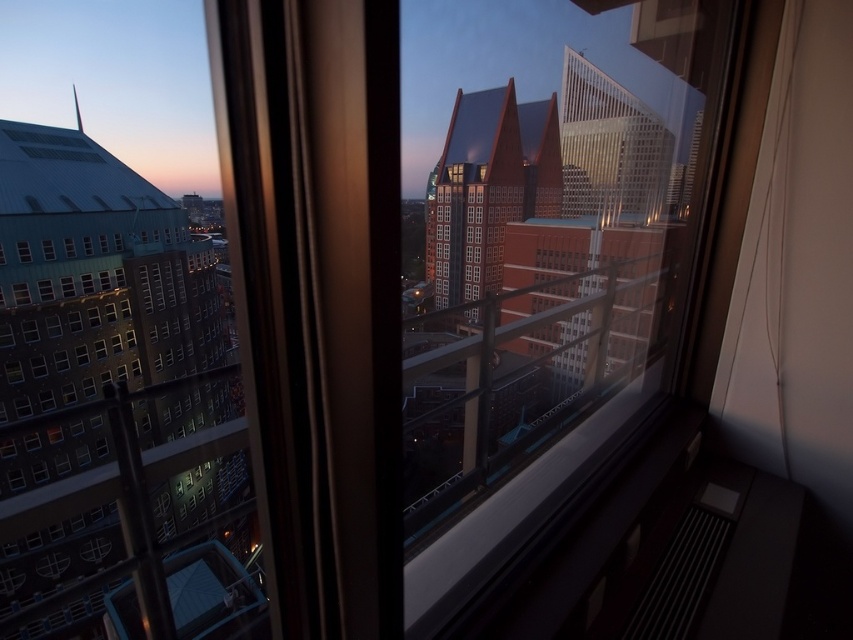
You are standing inside the building and want to look out through the transparent glass window at lower left. Where exactly should you position yourself to ensure you can see the entire view outside through it?

To see the entire view outside through the transparent glass window at lower left, you should position yourself directly in front of it, as its 2D location is at point [22,252], which allows for a clear and unobstructed view.

You are standing inside the building looking through the window. There are two points marked on the window glass at coordinates point (27,246) and point (44,246). If you want to touch the point that is closer to you, which coordinate should you aim for?

Point (27,246) is closer to the viewer than point (44,246), so you should aim for point (27,246).

Consider the image. You are standing inside a building and looking through two windows. You notice a transparent glass window at lower left and a transparent glass window at center. Which window is located to the left of the other?

The transparent glass window at lower left is positioned on the left side of the transparent glass window at center.